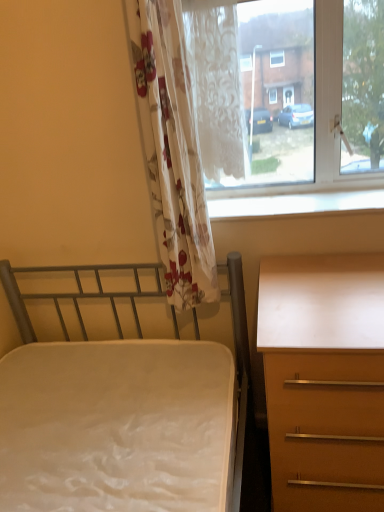
Question: Would you say metallic gray bed at left is outside white glossy window sill at upper center?

Choices:
 (A) no
 (B) yes

Answer: (B)

Question: Can you confirm if metallic gray bed at left is shorter than white glossy window sill at upper center?

Choices:
 (A) no
 (B) yes

Answer: (A)

Question: Would you consider metallic gray bed at left to be distant from white glossy window sill at upper center?

Choices:
 (A) yes
 (B) no

Answer: (B)

Question: Can you confirm if metallic gray bed at left is thinner than white glossy window sill at upper center?

Choices:
 (A) no
 (B) yes

Answer: (A)

Question: Is metallic gray bed at left further to the viewer compared to white glossy window sill at upper center?

Choices:
 (A) yes
 (B) no

Answer: (B)

Question: From the image's perspective, is white glossy window sill at upper center above or below white lace curtain at upper center, placed as the second curtain when sorted from left to right?

Choices:
 (A) below
 (B) above

Answer: (A)

Question: From a real-world perspective, is white glossy window sill at upper center positioned above or below white lace curtain at upper center, positioned as the 1th curtain in right-to-left order?

Choices:
 (A) above
 (B) below

Answer: (B)

Question: Is point (231, 204) positioned closer to the camera than point (223, 147)?

Choices:
 (A) closer
 (B) farther

Answer: (B)

Question: Is white glossy window sill at upper center taller or shorter than white lace curtain at upper center, placed as the second curtain when sorted from left to right?

Choices:
 (A) tall
 (B) short

Answer: (B)

Question: From their relative heights in the image, would you say metallic gray bed at left is taller or shorter than white lace curtain at upper center, positioned as the 1th curtain in right-to-left order?

Choices:
 (A) short
 (B) tall

Answer: (B)

Question: From the image's perspective, is metallic gray bed at left positioned above or below white lace curtain at upper center, placed as the second curtain when sorted from left to right?

Choices:
 (A) above
 (B) below

Answer: (B)

Question: From a real-world perspective, is metallic gray bed at left positioned above or below white lace curtain at upper center, placed as the second curtain when sorted from left to right?

Choices:
 (A) above
 (B) below

Answer: (B)

Question: Considering their positions, is metallic gray bed at left located in front of or behind white lace curtain at upper center, positioned as the 1th curtain in right-to-left order?

Choices:
 (A) behind
 (B) front

Answer: (B)

Question: Considering the positions of point tap(367, 289) and point tap(369, 204), is point tap(367, 289) closer or farther from the camera than point tap(369, 204)?

Choices:
 (A) closer
 (B) farther

Answer: (A)

Question: Would you say matte brown desk at right is inside or outside transparent glass window at upper right?

Choices:
 (A) outside
 (B) inside

Answer: (A)